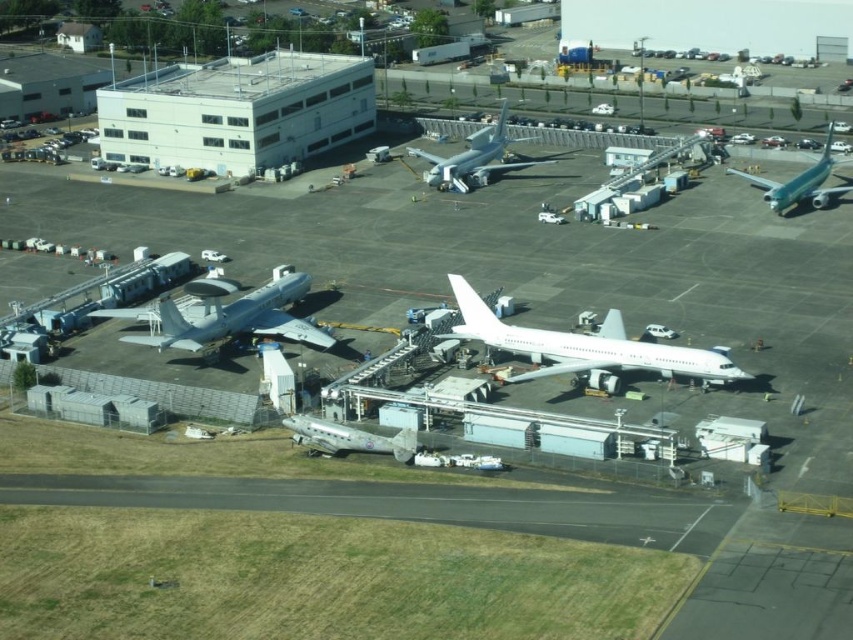
You are a ground crew member who needs to move a 20 meter long equipment truck between the metallic silver airplane at center and the metallic silver airplane at right. Can you safely maneuver the truck between them without hitting either airplane?

The metallic silver airplane at center and metallic silver airplane at right are 71.06 meters apart, so yes, the equipment truck which is 20 meters long can safely maneuver between them as there is sufficient space.

You are standing on the airport tarmac and want to walk from point (410,490) to point (827,200). Which direction should you head to get there?

You should head towards the background direction because point (827,200) is further away from the camera compared to point (410,490).